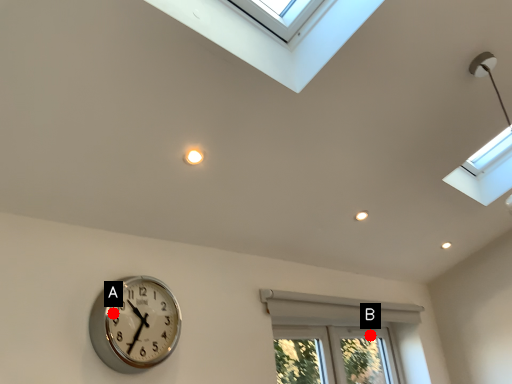
Question: Two points are circled on the image, labeled by A and B beside each circle. Which of the following is the farthest from the observer?

Choices:
 (A) A is further
 (B) B is further

Answer: (B)